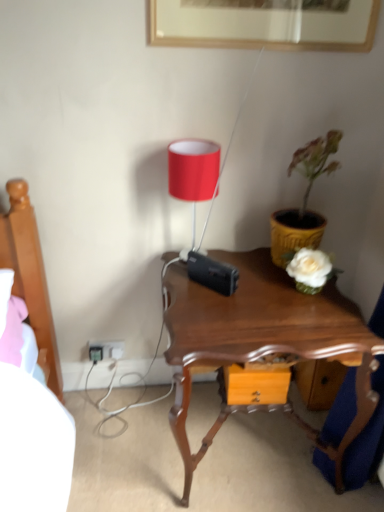
Question: Based on their sizes in the image, would you say black plastic plug at lower left is bigger or smaller than matte red lampshade at upper center?

Choices:
 (A) big
 (B) small

Answer: (B)

Question: Visually, is black plastic plug at lower left positioned to the left or to the right of matte red lampshade at upper center?

Choices:
 (A) right
 (B) left

Answer: (B)

Question: Which is nearer to the white plastic electric outlet at lower left?

Choices:
 (A) matte red lampshade at upper center
 (B) yellow textured pot at right
 (C) mahogany wood nightstand at center
 (D) black plastic plug at lower left

Answer: (D)

Question: Estimate the real-world distances between objects in this image. Which object is closer to the white plastic electric outlet at lower left?

Choices:
 (A) yellow textured pot at right
 (B) matte red lampshade at upper center
 (C) mahogany wood nightstand at center
 (D) black plastic plug at lower left

Answer: (D)